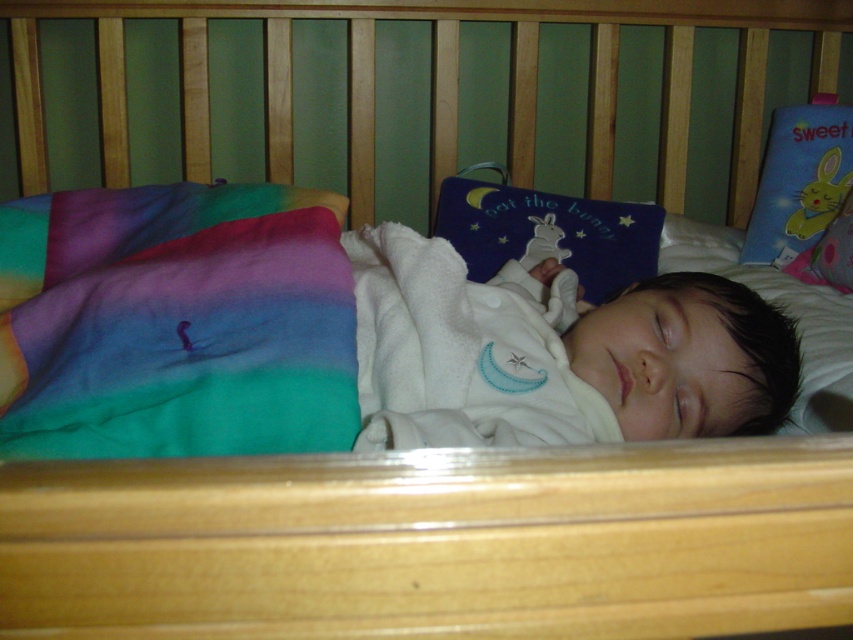
Question: Does multicolor fleece blanket at lower left have a greater width compared to blue fabric book at center?

Choices:
 (A) no
 (B) yes

Answer: (B)

Question: Does multicolor fleece blanket at lower left appear on the left side of blue fabric book at center?

Choices:
 (A) no
 (B) yes

Answer: (B)

Question: Which point appears closest to the camera in this image?

Choices:
 (A) (97, 257)
 (B) (457, 189)

Answer: (A)

Question: Considering the real-world distances, which object is farthest from the blue fabric book at center?

Choices:
 (A) blue fabric pillow at upper right
 (B) white soft baby at center
 (C) multicolor fleece blanket at lower left

Answer: (C)

Question: Is white soft baby at center above blue fabric book at center?

Choices:
 (A) yes
 (B) no

Answer: (B)

Question: Which point appears farthest from the camera in this image?

Choices:
 (A) (473, 198)
 (B) (747, 324)
 (C) (775, 195)
 (D) (25, 257)

Answer: (C)